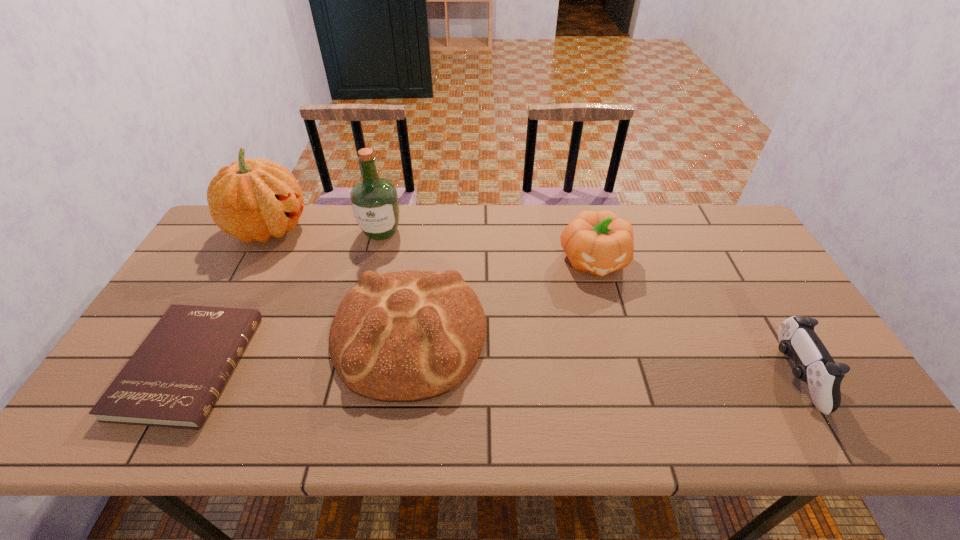
Where is `free space between the left pumpkin and the second object from right to left`? This screenshot has height=540, width=960. free space between the left pumpkin and the second object from right to left is located at coordinates (432, 245).

Find the location of a particular element. vacant space that is in between the left pumpkin and the shortest object is located at coordinates (229, 297).

This screenshot has width=960, height=540. What are the coordinates of `vacant area that lies between the hardback book and the taller pumpkin` in the screenshot? It's located at (229, 297).

The image size is (960, 540). Identify the location of free space between the bread and the shortest object. (300, 350).

Where is `vacant area that lies between the hardback book and the bread`? vacant area that lies between the hardback book and the bread is located at coordinates (300, 350).

Image resolution: width=960 pixels, height=540 pixels. Identify the location of vacant space in between the control and the liquor. (587, 304).

The width and height of the screenshot is (960, 540). Find the location of `free space between the liquor and the control`. free space between the liquor and the control is located at coordinates (587, 304).

At what (x,y) coordinates should I click in order to perform the action: click on free space between the shortest object and the rightmost object. Please return your answer as a coordinate pair (x, y). Looking at the image, I should click on (491, 371).

This screenshot has width=960, height=540. What are the coordinates of `object that is the second closest to the bread` in the screenshot? It's located at click(x=173, y=379).

What are the coordinates of `object that is the fourth closest one to the right pumpkin` in the screenshot? It's located at (251, 200).